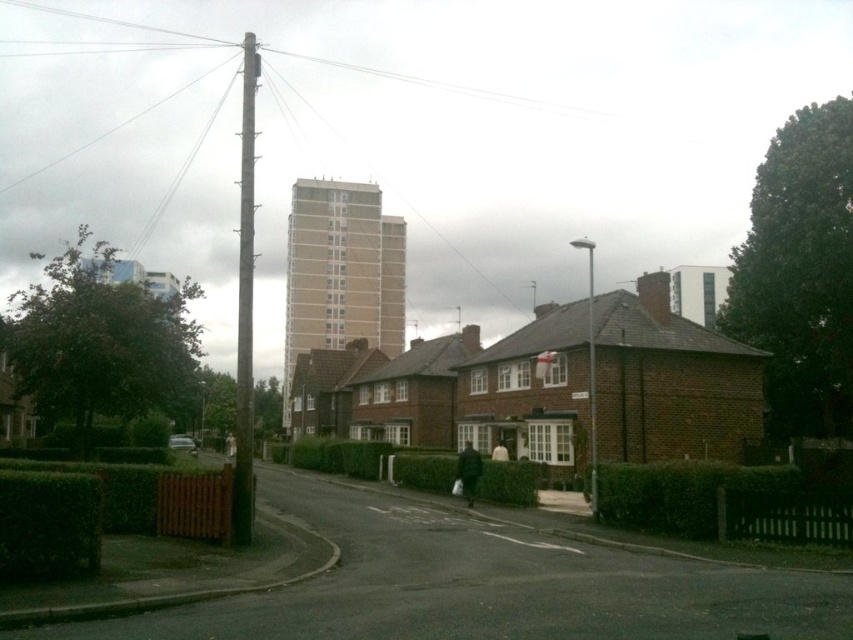
Question: In this image, where is smooth metallic pole at center located relative to silver metallic streetlight at center?

Choices:
 (A) right
 (B) left

Answer: (B)

Question: Can you confirm if smooth metallic pole at center is positioned above silver metallic streetlight at center?

Choices:
 (A) yes
 (B) no

Answer: (A)

Question: Where is smooth metallic pole at center located in relation to silver metallic streetlight at center in the image?

Choices:
 (A) left
 (B) right

Answer: (A)

Question: Which point is farther from the camera taking this photo?

Choices:
 (A) (590, 353)
 (B) (248, 180)

Answer: (B)

Question: Which of the following is the farthest from the observer?

Choices:
 (A) smooth metallic pole at center
 (B) silver metallic streetlight at center

Answer: (B)